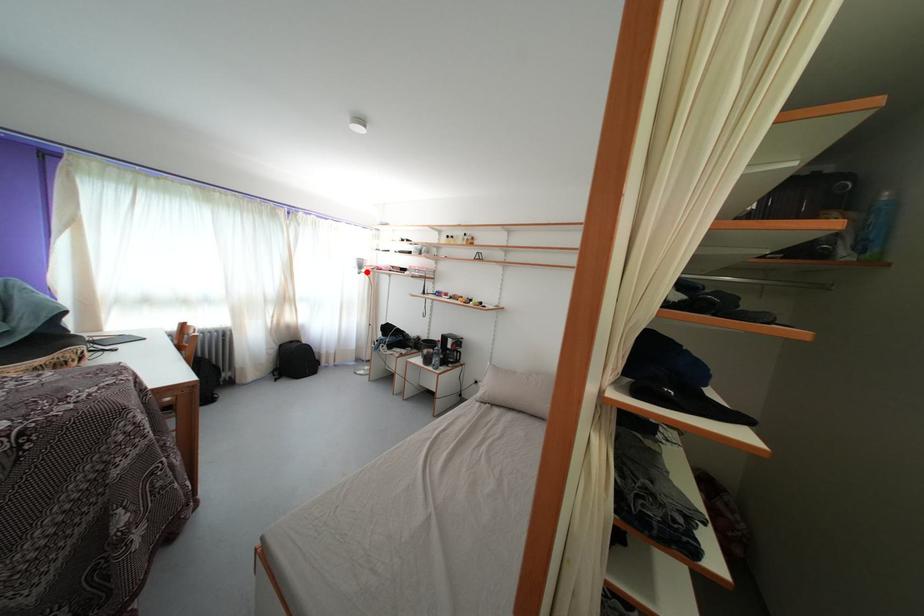
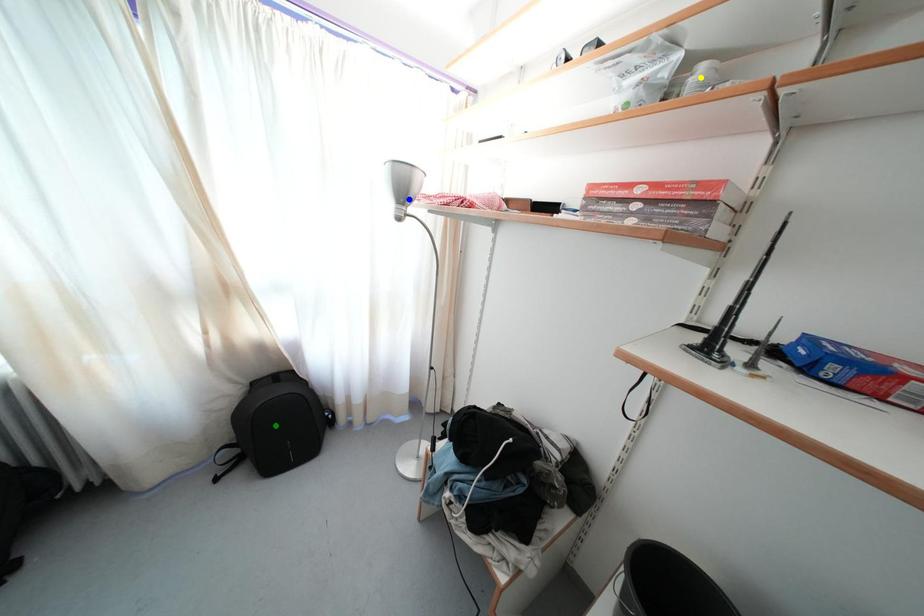
Question: I am providing you with two images of the same scene from different viewpoints. A red point is marked on the first image. You are given multiple points on the second image. In image 2, which mark is for the same physical point as the one in image 1?

Choices:
 (A) green point
 (B) yellow point
 (C) blue point

Answer: (C)